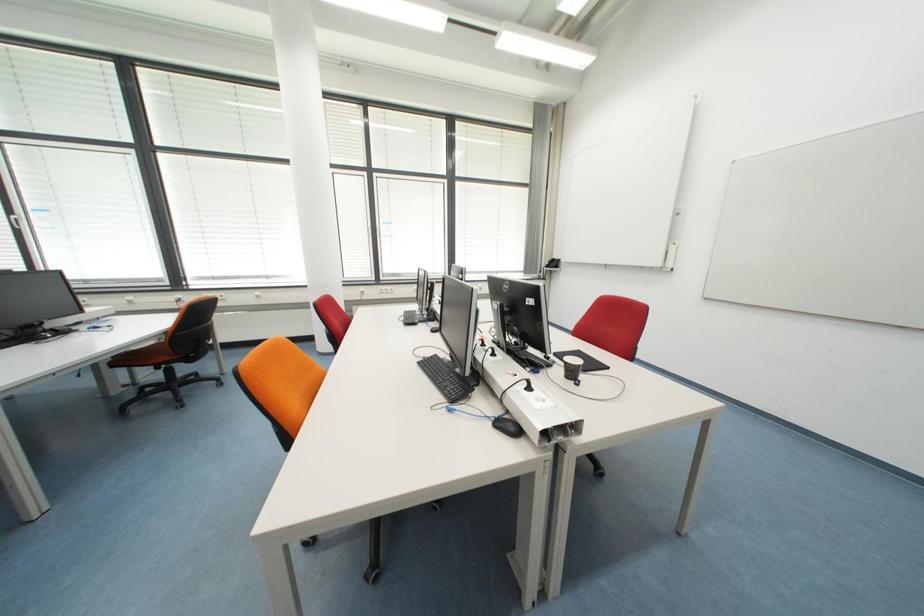
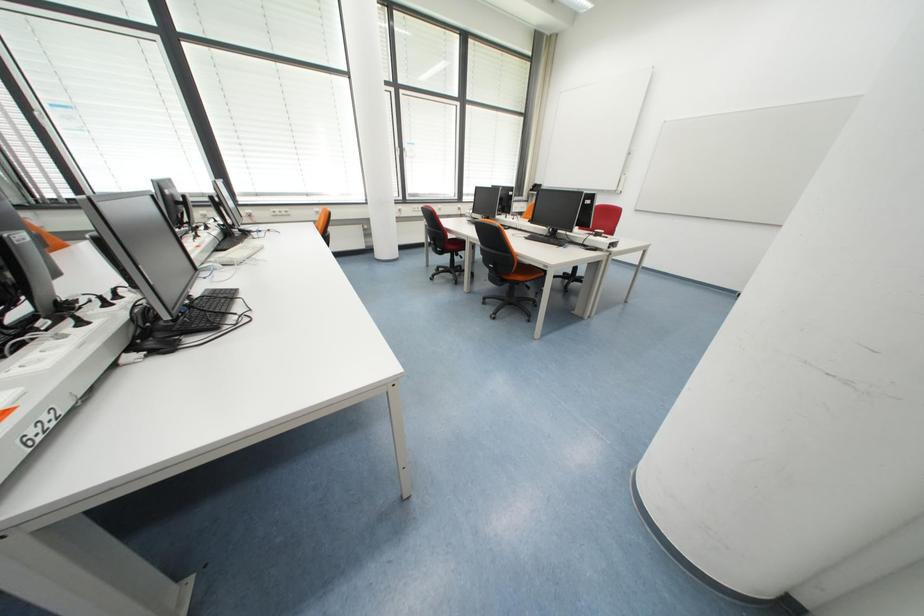
In a continuous first-person perspective shot, in which direction is the camera moving?

The movement direction of the cameraman is left, backward.